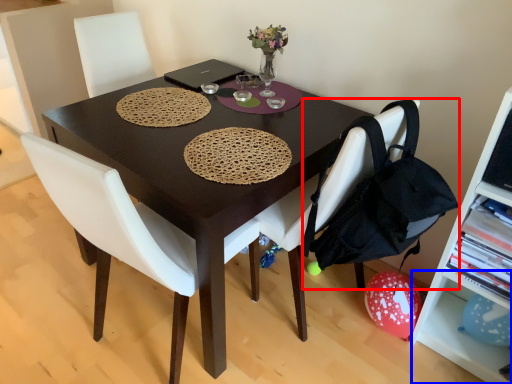
Question: Which object appears farthest to the camera in this image, handbag (highlighted by a red box) or shelf (highlighted by a blue box)?

Choices:
 (A) handbag
 (B) shelf

Answer: (B)